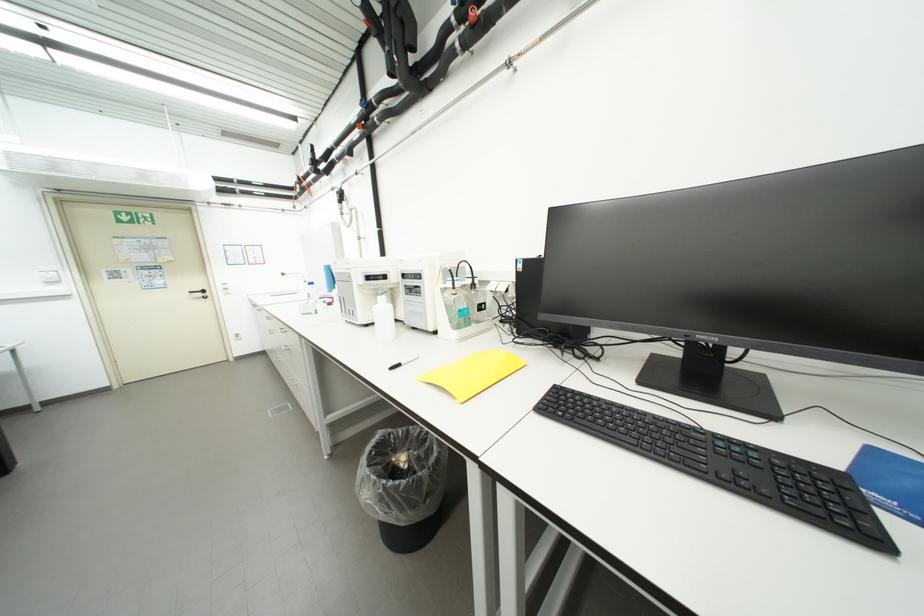
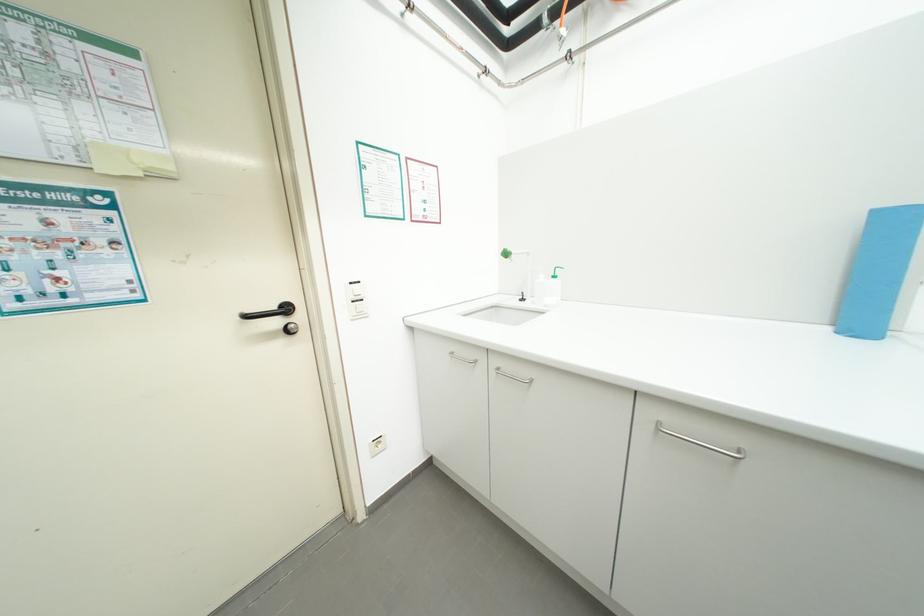
In the second image, find the point that corresponds to (208,296) in the first image.

(285, 323)